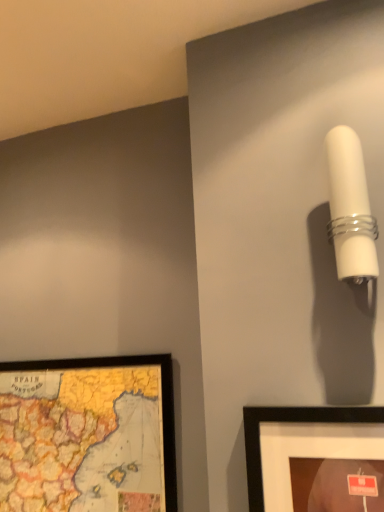
Question: Considering the relative sizes of wooden map at lower left and white glossy wall sconce at upper right in the image provided, is wooden map at lower left smaller than white glossy wall sconce at upper right?

Choices:
 (A) yes
 (B) no

Answer: (B)

Question: Is wooden map at lower left at the left side of white glossy wall sconce at upper right?

Choices:
 (A) no
 (B) yes

Answer: (B)

Question: Could white glossy wall sconce at upper right be considered to be inside wooden map at lower left?

Choices:
 (A) no
 (B) yes

Answer: (A)

Question: Is wooden map at lower left located outside white glossy wall sconce at upper right?

Choices:
 (A) yes
 (B) no

Answer: (A)

Question: From a real-world perspective, is wooden map at lower left located higher than white glossy wall sconce at upper right?

Choices:
 (A) no
 (B) yes

Answer: (A)

Question: Does wooden map at lower left have a lesser height compared to white glossy wall sconce at upper right?

Choices:
 (A) no
 (B) yes

Answer: (A)

Question: Is the position of white glossy wall sconce at upper right less distant than that of wooden map at lower left?

Choices:
 (A) no
 (B) yes

Answer: (B)

Question: From a real-world perspective, is white glossy wall sconce at upper right physically above wooden map at lower left?

Choices:
 (A) no
 (B) yes

Answer: (B)

Question: Can you confirm if white glossy wall sconce at upper right is smaller than wooden map at lower left?

Choices:
 (A) no
 (B) yes

Answer: (B)

Question: Can you confirm if white glossy wall sconce at upper right is positioned to the left of wooden map at lower left?

Choices:
 (A) yes
 (B) no

Answer: (B)

Question: Considering the relative sizes of white glossy wall sconce at upper right and wooden map at lower left in the image provided, is white glossy wall sconce at upper right thinner than wooden map at lower left?

Choices:
 (A) no
 (B) yes

Answer: (A)

Question: Can you confirm if white glossy wall sconce at upper right is taller than wooden map at lower left?

Choices:
 (A) yes
 (B) no

Answer: (B)

Question: Relative to wooden map at lower left, is white glossy wall sconce at upper right in front or behind?

Choices:
 (A) front
 (B) behind

Answer: (A)